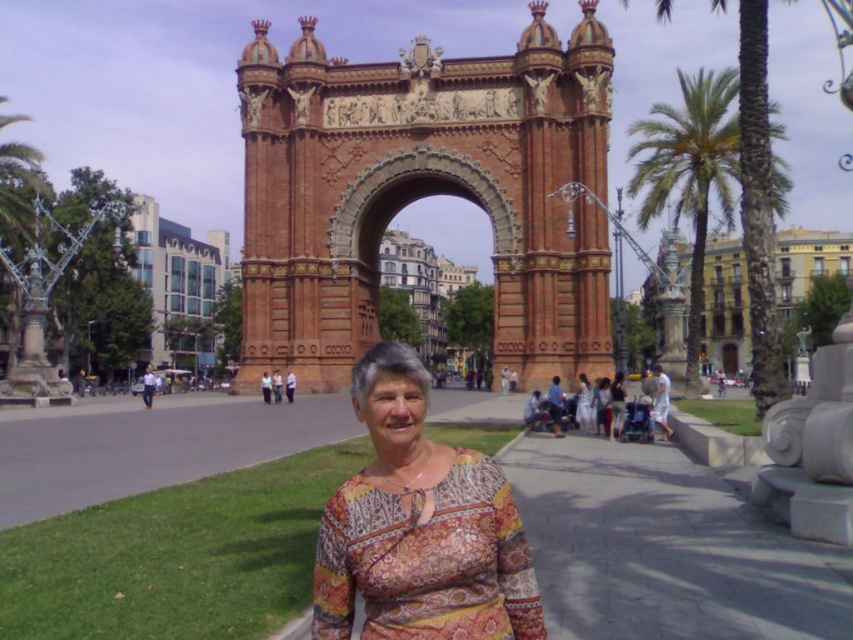
Who is more distant from viewer, (498, 176) or (618, 372)?

Point (498, 176)

Can you confirm if brown brick arch at center is positioned to the right of printed fabric blouse at center?

No, brown brick arch at center is not to the right of printed fabric blouse at center.

This screenshot has height=640, width=853. What are the coordinates of `brown brick arch at center` in the screenshot? It's located at (422, 193).

Can you confirm if green leafy palm tree at right is taller than printed fabric blouse at center?

Indeed, green leafy palm tree at right has a greater height compared to printed fabric blouse at center.

Does point (697, 269) come farther from viewer compared to point (619, 416)?

Yes.

The image size is (853, 640). I want to click on green leafy palm tree at right, so click(689, 172).

Between point (409, 424) and point (699, 305), which one is positioned behind?

The point (699, 305) is behind.

Can you confirm if printed cotton blouse at center is shorter than green leafy palm tree at right?

Indeed, printed cotton blouse at center has a lesser height compared to green leafy palm tree at right.

Does point (463, 576) come farther from viewer compared to point (689, 129)?

That is False.

Where is `printed cotton blouse at center`? This screenshot has height=640, width=853. printed cotton blouse at center is located at coordinates tap(419, 528).